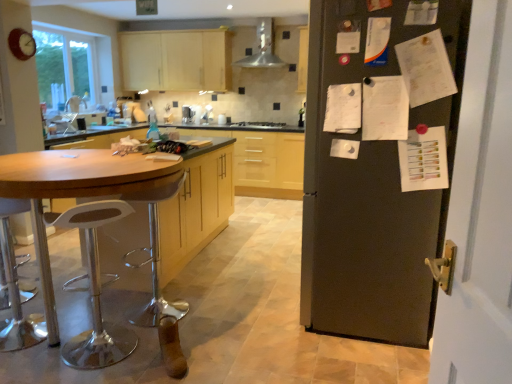
Where is `free point in front of matte black refrigerator at right`? This screenshot has height=384, width=512. free point in front of matte black refrigerator at right is located at coordinates pyautogui.click(x=346, y=359).